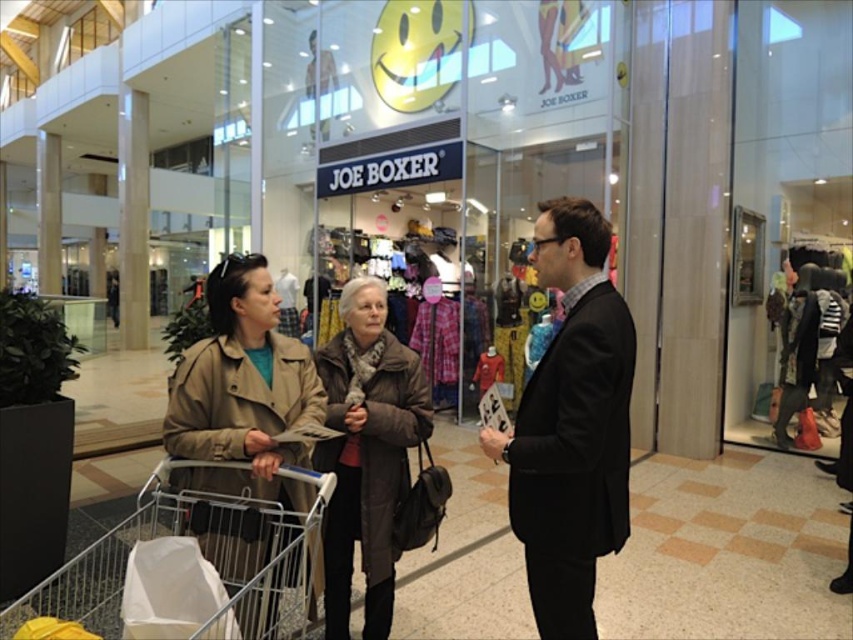
Can you confirm if tan leather coat at lower left is thinner than metallic silver shopping cart at lower left?

Indeed, tan leather coat at lower left has a lesser width compared to metallic silver shopping cart at lower left.

Who is more distant from viewer, (199, 518) or (318, 502)?

The point (199, 518) is more distant.

I want to click on tan leather coat at lower left, so click(242, 392).

The height and width of the screenshot is (640, 853). I want to click on brown fuzzy coat at center, so click(366, 452).

Does tan leather coat at lower left appear on the left side of brown fuzzy coat at center?

Indeed, tan leather coat at lower left is positioned on the left side of brown fuzzy coat at center.

Who is shorter, tan leather coat at lower left or brown fuzzy coat at center?

tan leather coat at lower left is shorter.

What do you see at coordinates (242, 392) in the screenshot? This screenshot has height=640, width=853. I see `tan leather coat at lower left` at bounding box center [242, 392].

Identify the location of tan leather coat at lower left. The width and height of the screenshot is (853, 640). (242, 392).